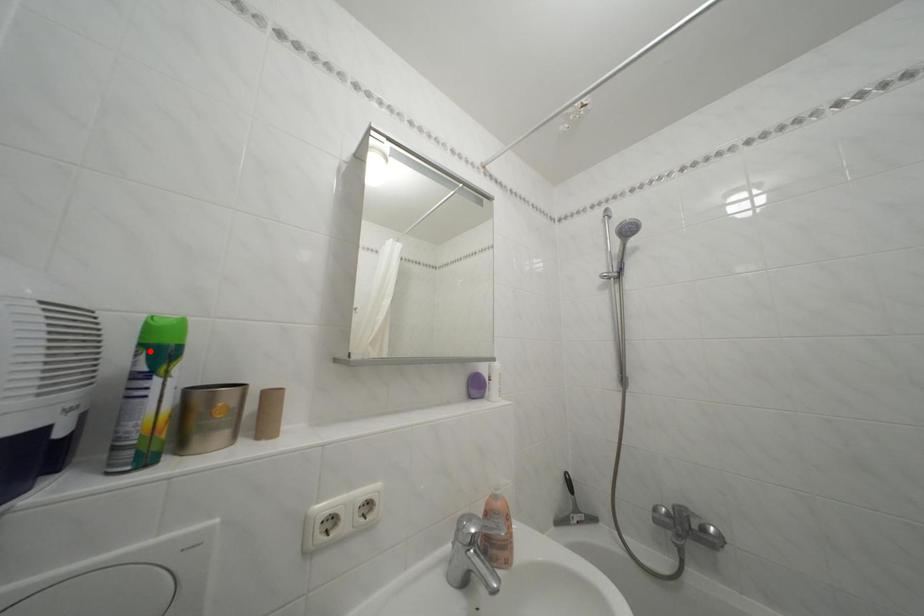
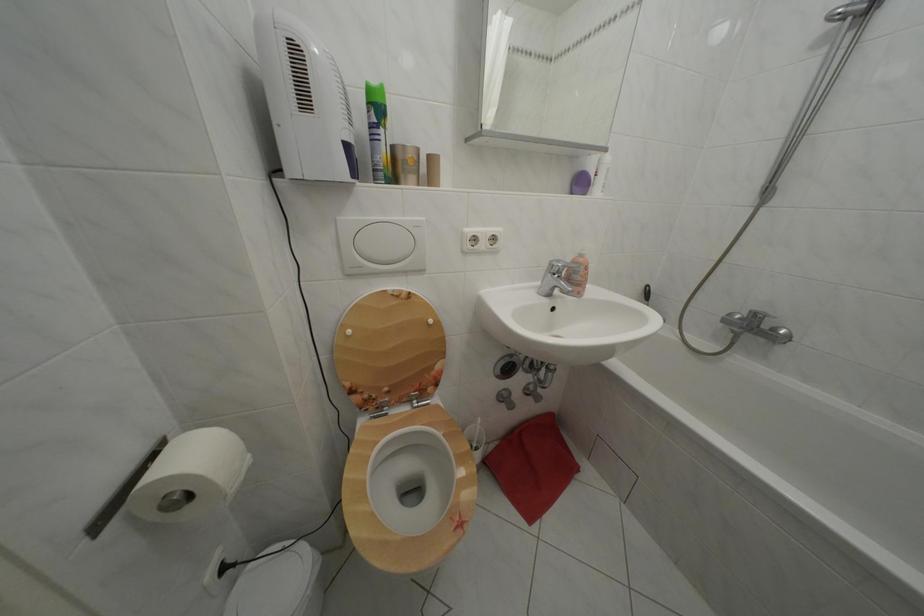
The point at the highlighted location is marked in the first image. Where is the corresponding point in the second image?

(378, 110)